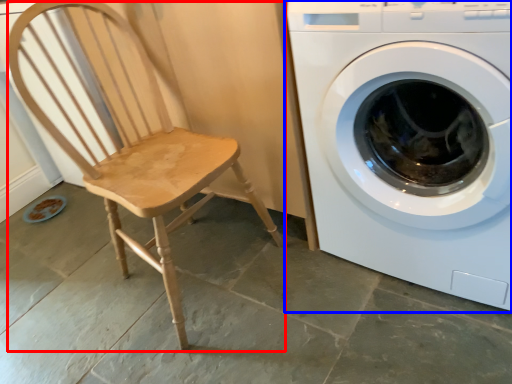
Question: Among these objects, which one is nearest to the camera, rocking chair (highlighted by a red box) or washing machine (highlighted by a blue box)?

Choices:
 (A) rocking chair
 (B) washing machine

Answer: (B)